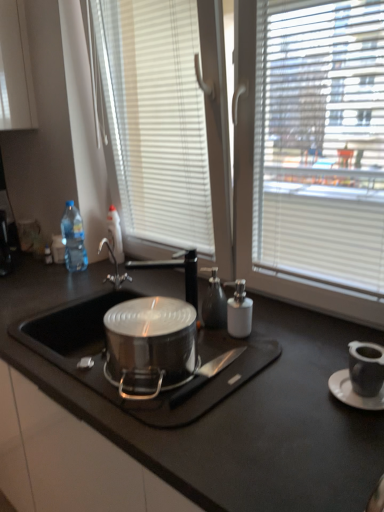
Question: From the image's perspective, is black matte knife at center located above or below white ceramic saucer at lower right?

Choices:
 (A) above
 (B) below

Answer: (A)

Question: Is point (208, 377) closer or farther from the camera than point (347, 370)?

Choices:
 (A) farther
 (B) closer

Answer: (B)

Question: Which object is positioned closest to the black matte countertop at center?

Choices:
 (A) black matte tap at center
 (B) translucent plastic bottle at upper left, which is the 2th bottle in left-to-right order
 (C) transparent plastic bottle at left, the 1th bottle positioned from the left
 (D) black matte knife at center
 (E) glossy ceramic mug at upper right

Answer: (D)

Question: Which is farther from the black matte knife at center?

Choices:
 (A) glossy ceramic mug at upper right
 (B) black matte tap at center
 (C) translucent plastic bottle at upper left, positioned as the 1th bottle in right-to-left order
 (D) transparent plastic bottle at left, acting as the second bottle starting from the right
 (E) white ceramic saucer at lower right

Answer: (D)